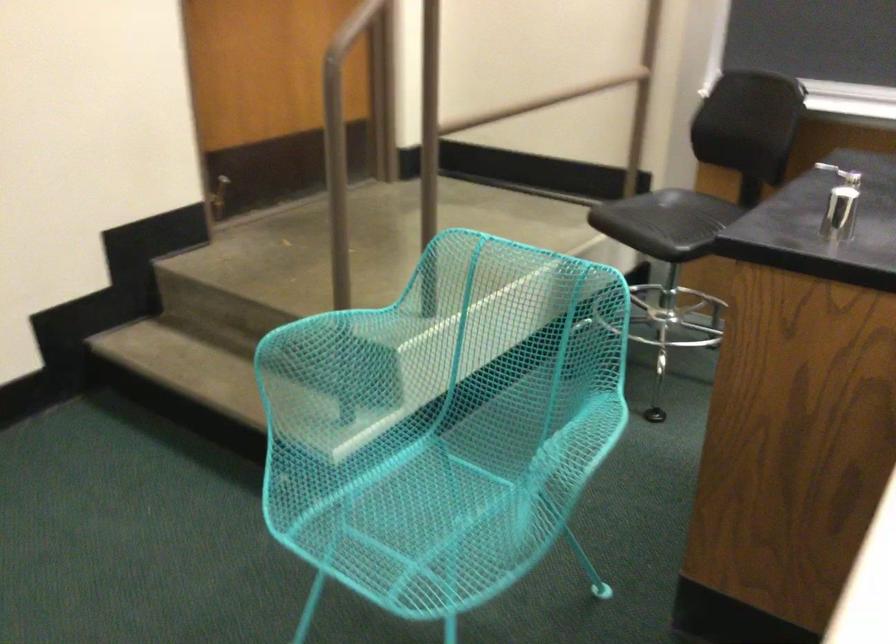
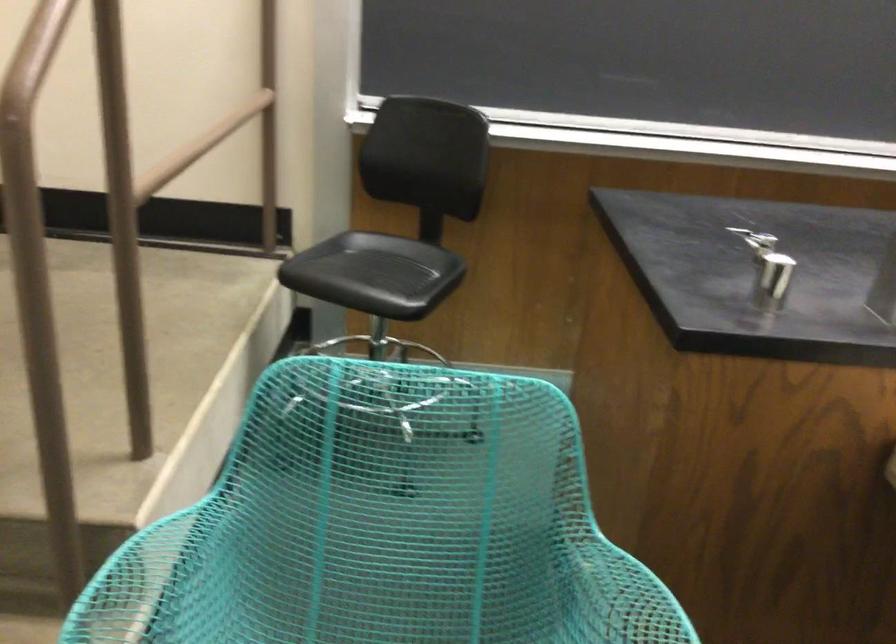
Locate, in the second image, the point that corresponds to (x=316, y=335) in the first image.

(150, 582)